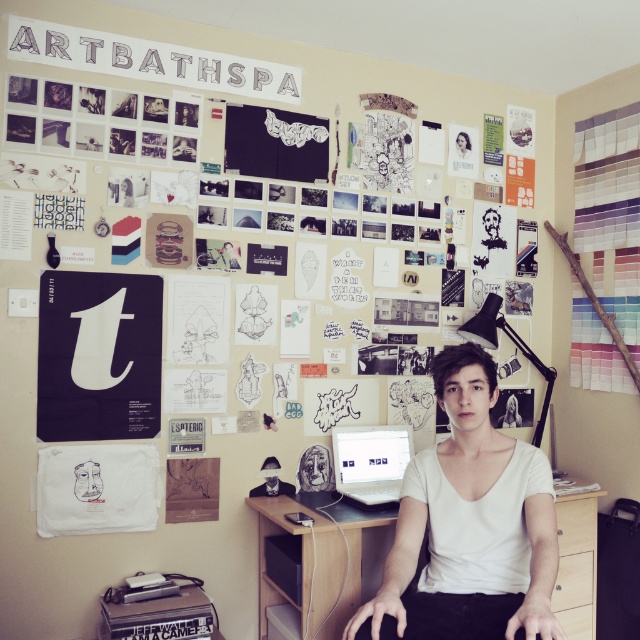
Question: Where is matte black poster at upper center located in relation to wooden at center in the image?

Choices:
 (A) above
 (B) below

Answer: (A)

Question: Can you confirm if matte black poster at upper center is smaller than white cotton shirt at center?

Choices:
 (A) no
 (B) yes

Answer: (A)

Question: Which of the following is the closest to the observer?

Choices:
 (A) (365, 499)
 (B) (280, 504)
 (C) (246, 403)

Answer: (A)

Question: Does wooden at center appear under satin silver laptop at center?

Choices:
 (A) no
 (B) yes

Answer: (B)

Question: Which of the following is the closest to the observer?

Choices:
 (A) wooden at center
 (B) satin silver laptop at center
 (C) matte black poster at upper center
 (D) white cotton shirt at center

Answer: (D)

Question: Which point is farther to the camera?

Choices:
 (A) (330, 580)
 (B) (385, 589)

Answer: (A)